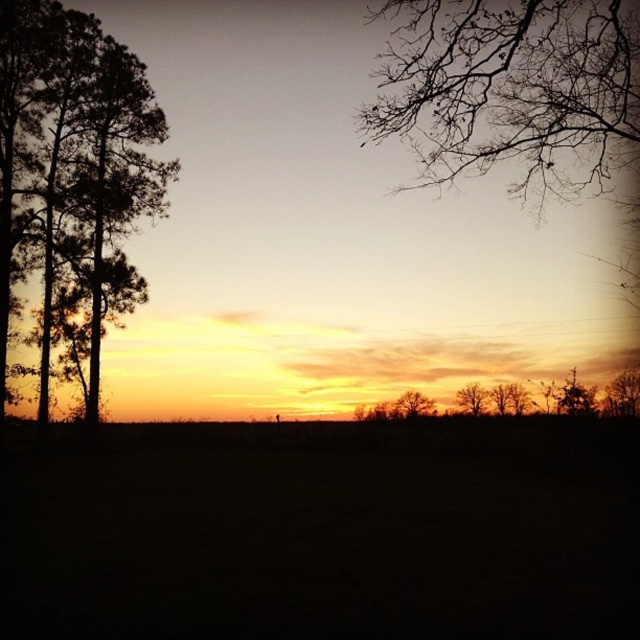
You are standing in the sunset scene and want to place a small flag at each of the two points marked in the image. The first point is at coordinates point (628, 397) and the second is at point (460, 388). If you want to place both flags so that the one closer to you is visible without being blocked by the other, which point should you place the closer flag at?

You should place the closer flag at point (628, 397) because it is closer to the camera than point (460, 388), ensuring it remains visible without obstruction.

You are standing in the middle of the field in the sunset scene. You want to walk towards the brown textured tree at right. Which direction should you head?

The brown textured tree at right is located at point 0.616 on the x axis and 0.975 on the y axis. Since you are in the middle of the field, you should head towards the right direction to reach the brown textured tree at right.